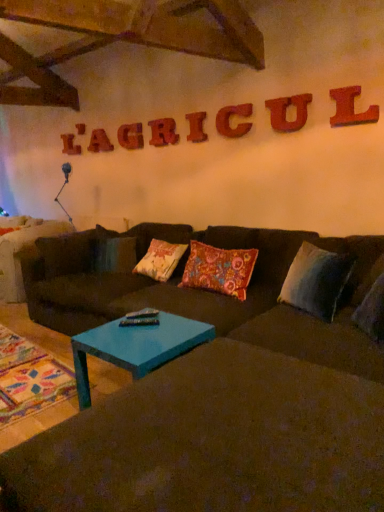
Question: Considering the positions of teal glossy coffee table at center and dark brown fabric couch at center in the image, is teal glossy coffee table at center wider or thinner than dark brown fabric couch at center?

Choices:
 (A) wide
 (B) thin

Answer: (B)

Question: Is teal glossy coffee table at center inside or outside of dark brown fabric couch at center?

Choices:
 (A) inside
 (B) outside

Answer: (A)

Question: Which of these objects is positioned closest to the dark brown fabric couch at center?

Choices:
 (A) gray fabric pillow at right, which appears as the 2th pillow when viewed from the left
 (B) teal glossy coffee table at center
 (C) floral-patterned fabric pillow at center, which appears as the second pillow when viewed from the right

Answer: (B)

Question: Which object is positioned closest to the gray fabric pillow at right, the first pillow when ordered from right to left?

Choices:
 (A) floral-patterned fabric pillow at center, which appears as the second pillow when viewed from the right
 (B) teal glossy coffee table at center
 (C) dark brown fabric couch at center

Answer: (A)